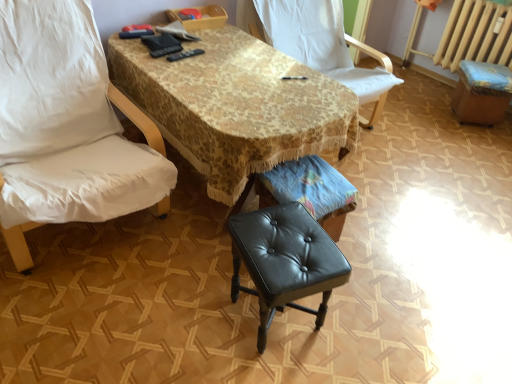
You are a GUI agent. You are given a task and a screenshot of the screen. Output one action in this format:
    pyautogui.click(x=<x>, y=<y>)
    Task: Click on the free space to the right of black leather stool at center
    
    Given the screenshot: What is the action you would take?
    pyautogui.click(x=362, y=322)